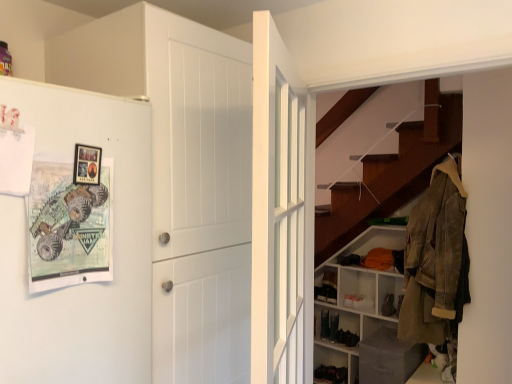
Question: Is matte black shoe at lower center, which is the first shoe from left to right, at the left side of white matte refrigerator at left?

Choices:
 (A) no
 (B) yes

Answer: (A)

Question: Considering the relative sizes of matte black shoe at lower center, which ranks as the third shoe in front-to-back order, and white matte refrigerator at left in the image provided, is matte black shoe at lower center, which ranks as the third shoe in front-to-back order, smaller than white matte refrigerator at left?

Choices:
 (A) yes
 (B) no

Answer: (A)

Question: Can you confirm if matte black shoe at lower center, the third shoe viewed from the right, is wider than white matte refrigerator at left?

Choices:
 (A) no
 (B) yes

Answer: (A)

Question: From a real-world perspective, is matte black shoe at lower center, the third shoe viewed from the right, positioned under white matte refrigerator at left based on gravity?

Choices:
 (A) yes
 (B) no

Answer: (A)

Question: Could you tell me if matte black shoe at lower center, which is the first shoe in back-to-front order, is turned towards white matte refrigerator at left?

Choices:
 (A) no
 (B) yes

Answer: (B)

Question: From the image's perspective, does matte black shoe at lower center, the third shoe viewed from the right, appear higher than white matte refrigerator at left?

Choices:
 (A) no
 (B) yes

Answer: (A)

Question: Is white matte refrigerator at left taller than white matte door at center, which is the 1th door from left to right?

Choices:
 (A) no
 (B) yes

Answer: (A)

Question: From the image's perspective, does white matte refrigerator at left appear lower than white matte door at center, which is the 1th door from left to right?

Choices:
 (A) yes
 (B) no

Answer: (A)

Question: Are white matte refrigerator at left and white matte door at center, placed as the second door when sorted from right to left, making contact?

Choices:
 (A) yes
 (B) no

Answer: (B)

Question: Is white matte refrigerator at left outside white matte door at center, which is the 1th door from left to right?

Choices:
 (A) no
 (B) yes

Answer: (B)

Question: From a real-world perspective, is white matte refrigerator at left beneath white matte door at center, which is the 1th door from left to right?

Choices:
 (A) yes
 (B) no

Answer: (A)

Question: Can you confirm if white matte refrigerator at left is smaller than white matte door at center, which is the 1th door from left to right?

Choices:
 (A) no
 (B) yes

Answer: (B)

Question: Is matte black shoe at lower center, which ranks as the third shoe in front-to-back order, thinner than gray fabric box at lower right, the first shelf when ordered from front to back?

Choices:
 (A) yes
 (B) no

Answer: (A)